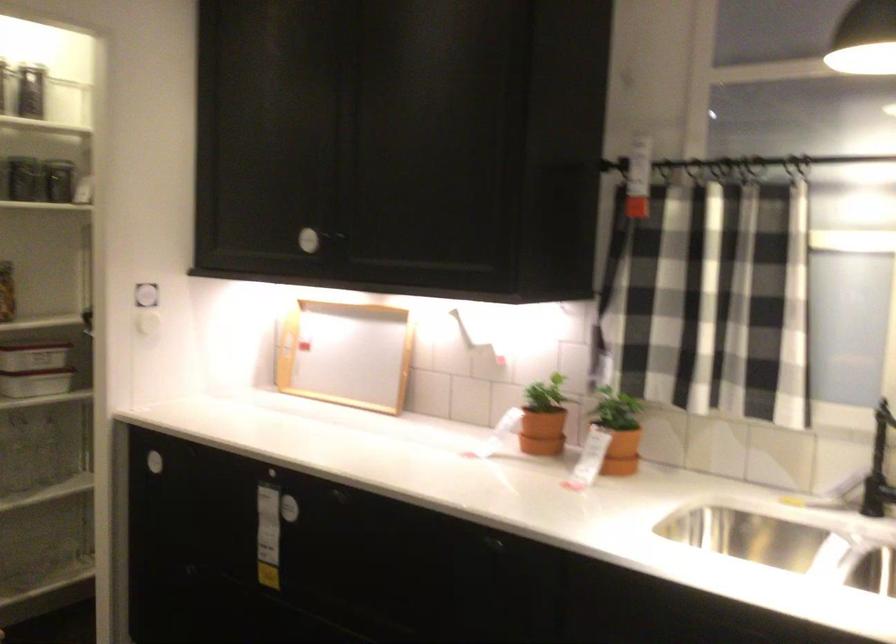
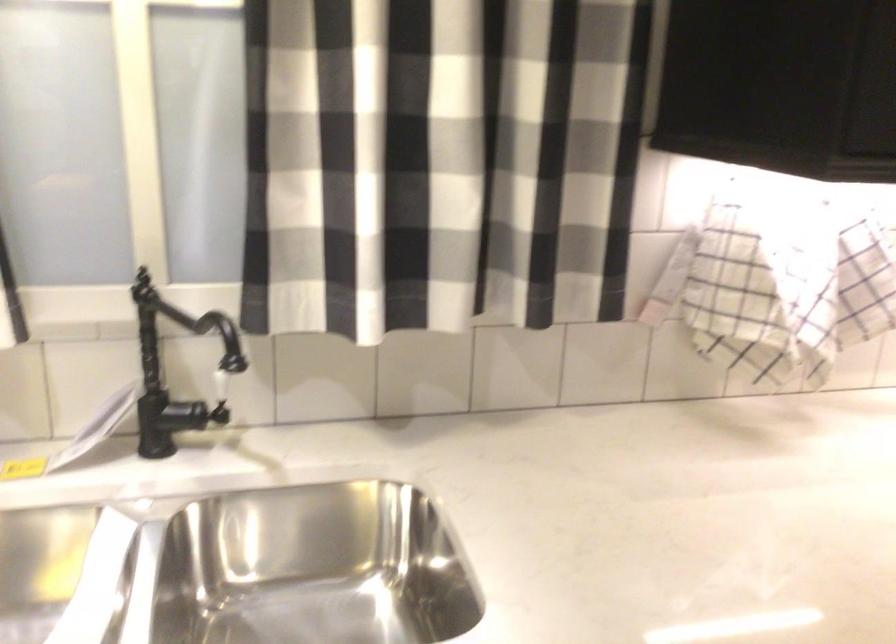
Question: How did the camera likely rotate?

Choices:
 (A) Left
 (B) Right
 (C) Up
 (D) Down

Answer: (B)